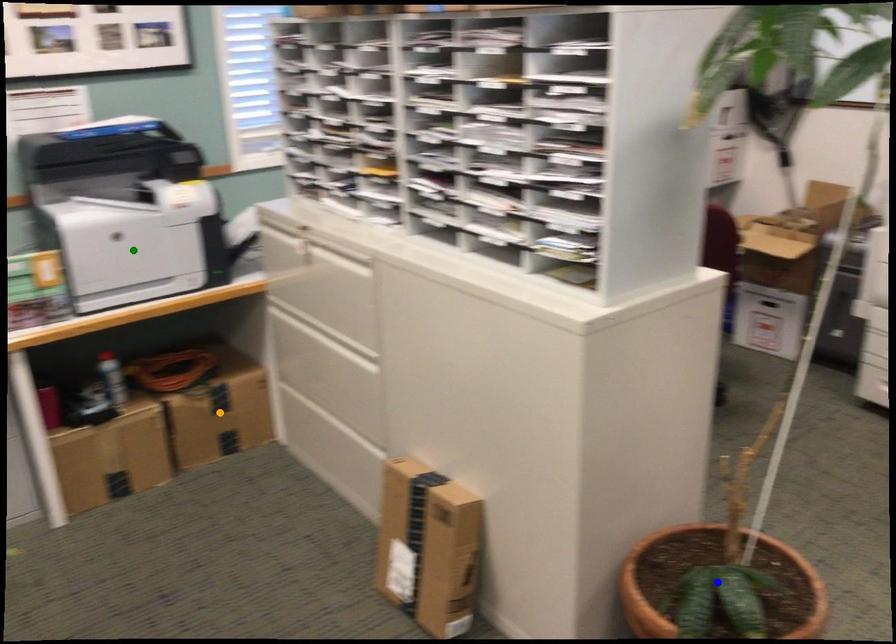
Order these from nearest to farthest:
A) orange point
B) green point
C) blue point

blue point
green point
orange point